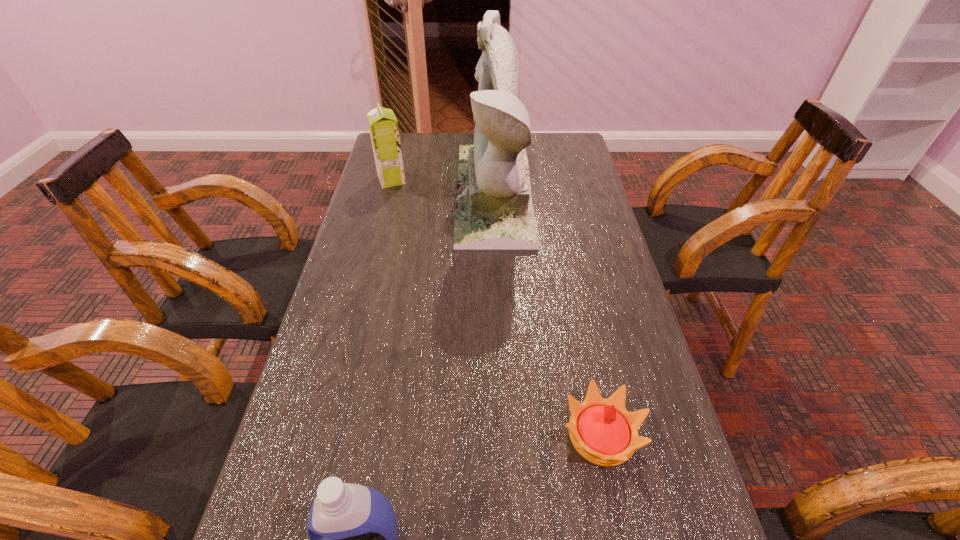
At what (x,y) coordinates should I click in order to perform the action: click on the tallest object. Please return your answer as a coordinate pair (x, y). The height and width of the screenshot is (540, 960). Looking at the image, I should click on (494, 210).

This screenshot has width=960, height=540. What are the coordinates of `soya milk` in the screenshot? It's located at (383, 126).

Where is `the third farthest object`? Image resolution: width=960 pixels, height=540 pixels. the third farthest object is located at coordinates (602, 431).

Locate an element on the screen. The height and width of the screenshot is (540, 960). the shortest object is located at coordinates (602, 431).

I want to click on vacant region located on the base of the sculpture, so click(420, 195).

The image size is (960, 540). I want to click on blank space located 0.080m on the base of the sculpture, so click(432, 195).

Locate an element on the screen. Image resolution: width=960 pixels, height=540 pixels. blank area located 0.190m on the base of the sculpture is located at coordinates (397, 195).

Where is `vacant space situated 0.350m on the front of the soya milk`? The width and height of the screenshot is (960, 540). vacant space situated 0.350m on the front of the soya milk is located at coordinates (371, 262).

Identify the location of free space located on the back of the crown. This screenshot has width=960, height=540. (574, 300).

What are the coordinates of `object that is positioned at the far edge` in the screenshot? It's located at (494, 210).